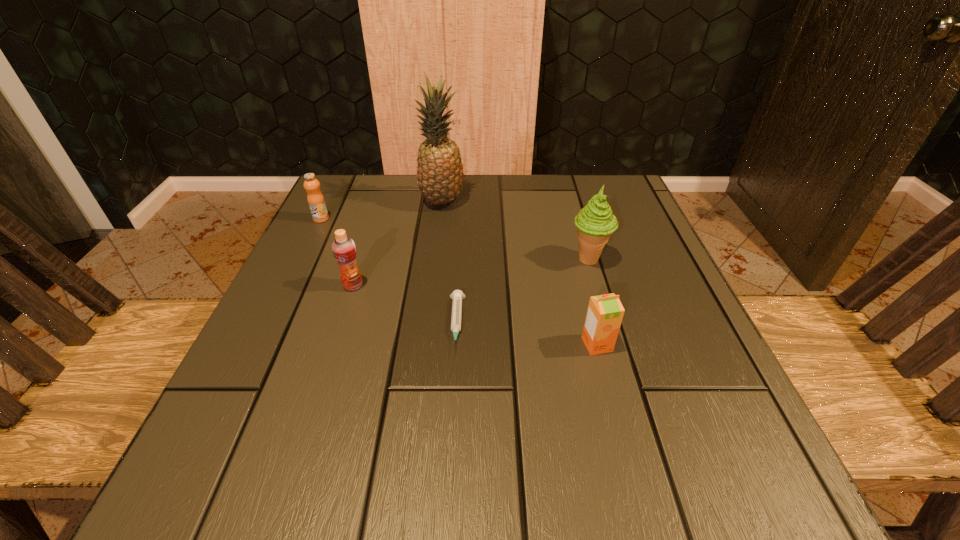
Find the location of a particular element. The image size is (960, 540). free space that satisfies the following two spatial constraints: 1. on the front label of the farthest orange juice; 2. on the left side of the nearest orange juice is located at coordinates (260, 345).

The height and width of the screenshot is (540, 960). What are the coordinates of `free point that satisfies the following two spatial constraints: 1. at the needle end of the nearest orange juice; 2. on the right side of the shortest object` in the screenshot? It's located at (455, 345).

Find the location of a particular element. The width and height of the screenshot is (960, 540). free location that satisfies the following two spatial constraints: 1. on the front side of the pineapple; 2. on the left side of the nearest orange juice is located at coordinates 424,345.

Locate an element on the screen. vacant area in the image that satisfies the following two spatial constraints: 1. on the front label of the nearest orange juice; 2. on the left side of the leftmost object is located at coordinates (260, 345).